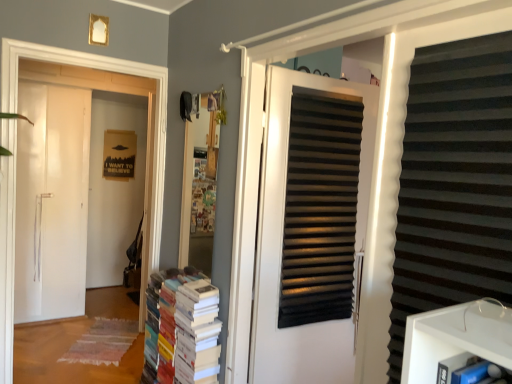
Question: Is black matte shutter at right aimed at white paper book at center?

Choices:
 (A) no
 (B) yes

Answer: (A)

Question: From a real-world perspective, is black matte shutter at right over white paper book at center?

Choices:
 (A) yes
 (B) no

Answer: (A)

Question: Considering the relative positions of black matte shutter at right and white paper book at center in the image provided, is black matte shutter at right to the right of white paper book at center from the viewer's perspective?

Choices:
 (A) yes
 (B) no

Answer: (A)

Question: Can you confirm if black matte shutter at right is taller than white paper book at center?

Choices:
 (A) yes
 (B) no

Answer: (A)

Question: Would you say white paper book at center is part of black matte shutter at right's contents?

Choices:
 (A) yes
 (B) no

Answer: (B)

Question: Does black matte shutter at right have a lesser width compared to white paper book at center?

Choices:
 (A) no
 (B) yes

Answer: (B)

Question: From a real-world perspective, is white paper book at center on black matte door at center, the first door when ordered from front to back?

Choices:
 (A) no
 (B) yes

Answer: (A)

Question: Is white paper book at center taller than black matte door at center, the first door when ordered from front to back?

Choices:
 (A) yes
 (B) no

Answer: (B)

Question: From the image's perspective, would you say white paper book at center is positioned over black matte door at center, which ranks as the second door in left-to-right order?

Choices:
 (A) no
 (B) yes

Answer: (A)

Question: Is white paper book at center thinner than black matte door at center, the first door when ordered from front to back?

Choices:
 (A) no
 (B) yes

Answer: (A)

Question: Is the position of white paper book at center less distant than that of black matte door at center, the first door viewed from the right?

Choices:
 (A) yes
 (B) no

Answer: (B)

Question: Is white paper book at center shorter than black matte door at center, the 2th door viewed from the back?

Choices:
 (A) no
 (B) yes

Answer: (B)

Question: Is white paper book at center further to the viewer compared to white matte door at left, placed as the second door when sorted from right to left?

Choices:
 (A) yes
 (B) no

Answer: (B)